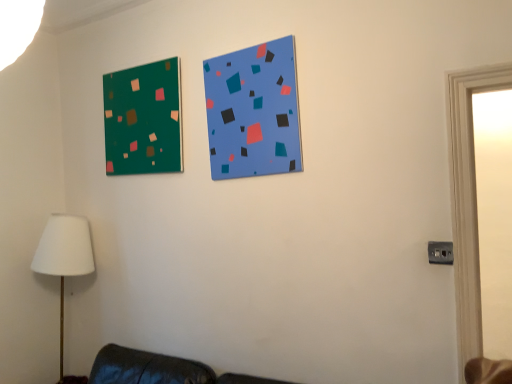
Identify the location of green matte board at upper left, the second bulletin board viewed from the front. (143, 119).

The width and height of the screenshot is (512, 384). I want to click on blue matte bulletin board at upper center, which is counted as the second bulletin board, starting from the back, so click(x=253, y=111).

Does point (210, 66) appear closer or farther from the camera than point (158, 157)?

Point (210, 66) is closer to the camera than point (158, 157).

From the image's perspective, is blue matte bulletin board at upper center, the first bulletin board positioned from the front, located above or below green matte board at upper left, which is the 1th bulletin board from left to right?

From the image's perspective, blue matte bulletin board at upper center, the first bulletin board positioned from the front, appears below green matte board at upper left, which is the 1th bulletin board from left to right.

Can you tell me how much blue matte bulletin board at upper center, which is counted as the second bulletin board, starting from the back, and green matte board at upper left, which is the 1th bulletin board from left to right, differ in facing direction?

They differ by 0.728 degrees in their facing directions.

In the scene shown: Can you confirm if blue matte bulletin board at upper center, the first bulletin board positioned from the front, is thinner than green matte board at upper left, the 1th bulletin board viewed from the back?

Indeed, blue matte bulletin board at upper center, the first bulletin board positioned from the front, has a lesser width compared to green matte board at upper left, the 1th bulletin board viewed from the back.

Is green matte board at upper left, the second bulletin board viewed from the front, oriented towards white fabric lampshade at lower left?

No, green matte board at upper left, the second bulletin board viewed from the front, is not facing towards white fabric lampshade at lower left.

From a real-world perspective, is green matte board at upper left, the second bulletin board viewed from the front, over white fabric lampshade at lower left?

Yes, from a real-world perspective, green matte board at upper left, the second bulletin board viewed from the front, is above white fabric lampshade at lower left.

Considering the positions of points (140, 71) and (74, 223), is point (140, 71) closer to camera compared to point (74, 223)?

Yes.

Is green matte board at upper left, which is the 1th bulletin board from left to right, in front of white fabric lampshade at lower left?

Yes, it is in front of white fabric lampshade at lower left.

Based on the photo, is the surface of blue matte bulletin board at upper center, the 2th bulletin board in the left-to-right sequence, in direct contact with white fabric lampshade at lower left?

No, blue matte bulletin board at upper center, the 2th bulletin board in the left-to-right sequence, is not next to white fabric lampshade at lower left.

From a real-world perspective, which object rests below the other?

From a 3D spatial view, white fabric lampshade at lower left is below.

Considering the sizes of blue matte bulletin board at upper center, the first bulletin board positioned from the front, and white fabric lampshade at lower left in the image, is blue matte bulletin board at upper center, the first bulletin board positioned from the front, wider or thinner than white fabric lampshade at lower left?

blue matte bulletin board at upper center, the first bulletin board positioned from the front, is thinner than white fabric lampshade at lower left.

Does blue matte bulletin board at upper center, the first bulletin board positioned from the front, have a lesser height compared to white fabric lampshade at lower left?

Yes, blue matte bulletin board at upper center, the first bulletin board positioned from the front, is shorter than white fabric lampshade at lower left.

Does green matte board at upper left, which is the 1th bulletin board from left to right, turn towards blue matte bulletin board at upper center, the first bulletin board in the right-to-left sequence?

No, green matte board at upper left, which is the 1th bulletin board from left to right, is not aimed at blue matte bulletin board at upper center, the first bulletin board in the right-to-left sequence.

Which is less distant, (104, 87) or (216, 152)?

The point (216, 152) is more forward.

From a real-world perspective, who is located higher, green matte board at upper left, which is counted as the 2th bulletin board, starting from the right, or blue matte bulletin board at upper center, the first bulletin board in the right-to-left sequence?

green matte board at upper left, which is counted as the 2th bulletin board, starting from the right, is physically above.

Considering the sizes of objects white fabric lampshade at lower left and green matte board at upper left, which is the 1th bulletin board from left to right, in the image provided, who is wider, white fabric lampshade at lower left or green matte board at upper left, which is the 1th bulletin board from left to right,?

With larger width is white fabric lampshade at lower left.

Considering the positions of objects white fabric lampshade at lower left and green matte board at upper left, the second bulletin board viewed from the front, in the image provided, who is more to the right, white fabric lampshade at lower left or green matte board at upper left, the second bulletin board viewed from the front,?

green matte board at upper left, the second bulletin board viewed from the front.

Is white fabric lampshade at lower left looking in the opposite direction of green matte board at upper left, which is counted as the 2th bulletin board, starting from the right?

No, green matte board at upper left, which is counted as the 2th bulletin board, starting from the right, is not at the back of white fabric lampshade at lower left.

Is white fabric lampshade at lower left positioned far away from blue matte bulletin board at upper center, which is counted as the second bulletin board, starting from the back?

Yes, white fabric lampshade at lower left and blue matte bulletin board at upper center, which is counted as the second bulletin board, starting from the back, are located far from each other.

Does white fabric lampshade at lower left appear on the left side of blue matte bulletin board at upper center, the first bulletin board positioned from the front?

Correct, you'll find white fabric lampshade at lower left to the left of blue matte bulletin board at upper center, the first bulletin board positioned from the front.

Can you confirm if white fabric lampshade at lower left is bigger than blue matte bulletin board at upper center, the 2th bulletin board in the left-to-right sequence?

Indeed, white fabric lampshade at lower left has a larger size compared to blue matte bulletin board at upper center, the 2th bulletin board in the left-to-right sequence.

The image size is (512, 384). In the image, there is a green matte board at upper left, the 1th bulletin board viewed from the back. In order to click on bulletin board below it (from the image's perspective) in this screenshot , I will do [x=253, y=111].

In order to click on table lamp on the left of the green matte board at upper left, which is the 1th bulletin board from left to right in this screenshot , I will do `click(64, 257)`.

Looking at the image, which one is located further to green matte board at upper left, which is counted as the 2th bulletin board, starting from the right, blue matte bulletin board at upper center, the 2th bulletin board in the left-to-right sequence, or white fabric lampshade at lower left?

white fabric lampshade at lower left is positioned further to the anchor green matte board at upper left, which is counted as the 2th bulletin board, starting from the right.

Looking at the image, which one is located further to white fabric lampshade at lower left, blue matte bulletin board at upper center, the 2th bulletin board in the left-to-right sequence, or green matte board at upper left, which is the 1th bulletin board from left to right?

blue matte bulletin board at upper center, the 2th bulletin board in the left-to-right sequence.

Which object lies nearer to the anchor point blue matte bulletin board at upper center, which is counted as the second bulletin board, starting from the back, white fabric lampshade at lower left or green matte board at upper left, the second bulletin board viewed from the front?

green matte board at upper left, the second bulletin board viewed from the front, lies closer to blue matte bulletin board at upper center, which is counted as the second bulletin board, starting from the back, than the other object.

When comparing their distances from blue matte bulletin board at upper center, the first bulletin board in the right-to-left sequence, does green matte board at upper left, the second bulletin board viewed from the front, or white fabric lampshade at lower left seem closer?

green matte board at upper left, the second bulletin board viewed from the front, is positioned closer to the anchor blue matte bulletin board at upper center, the first bulletin board in the right-to-left sequence.

When comparing their distances from white fabric lampshade at lower left, does green matte board at upper left, which is the 1th bulletin board from left to right, or blue matte bulletin board at upper center, the first bulletin board in the right-to-left sequence, seem further?

blue matte bulletin board at upper center, the first bulletin board in the right-to-left sequence, is further to white fabric lampshade at lower left.

When comparing their distances from green matte board at upper left, the second bulletin board viewed from the front, does white fabric lampshade at lower left or blue matte bulletin board at upper center, the 2th bulletin board in the left-to-right sequence, seem closer?

Among the two, blue matte bulletin board at upper center, the 2th bulletin board in the left-to-right sequence, is located nearer to green matte board at upper left, the second bulletin board viewed from the front.

The width and height of the screenshot is (512, 384). What are the coordinates of `bulletin board between green matte board at upper left, the second bulletin board viewed from the front, and white fabric lampshade at lower left from top to bottom` in the screenshot? It's located at (253, 111).